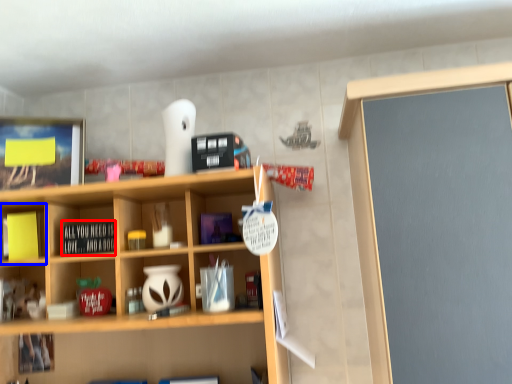
Question: Which point is closer to the camera, book (highlighted by a red box) or cabinet (highlighted by a blue box)?

Choices:
 (A) book
 (B) cabinet

Answer: (A)